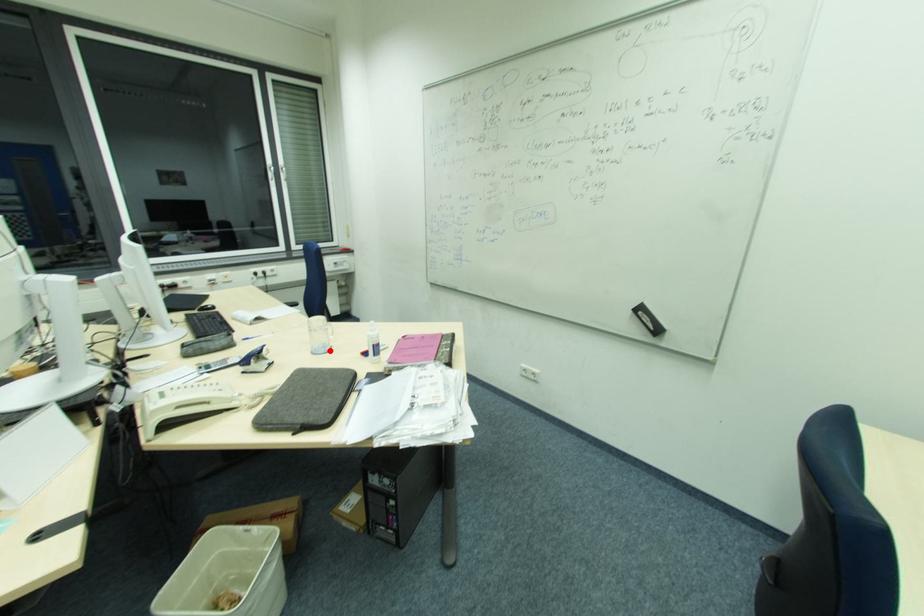
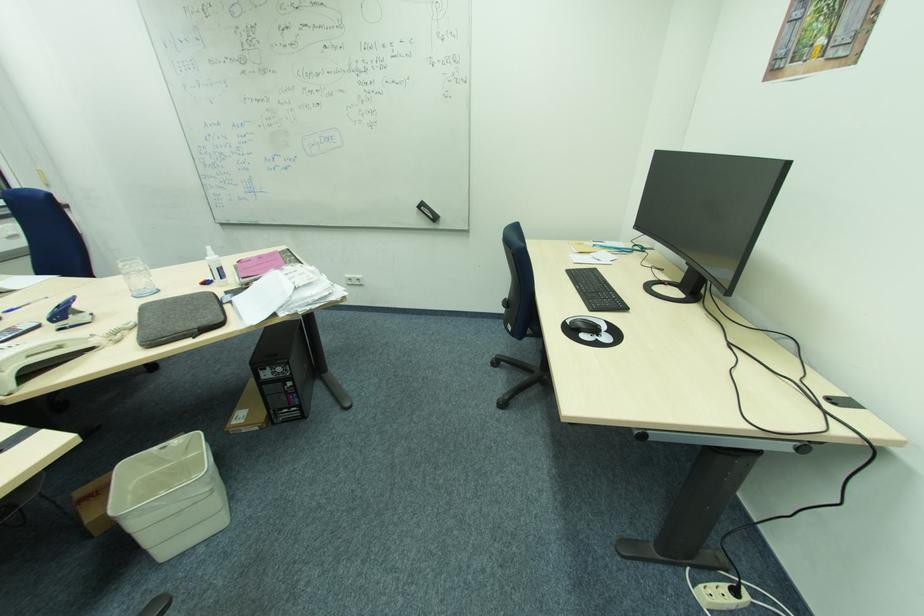
Locate, in the second image, the point that corresponds to the highlighted location in the first image.

(157, 292)